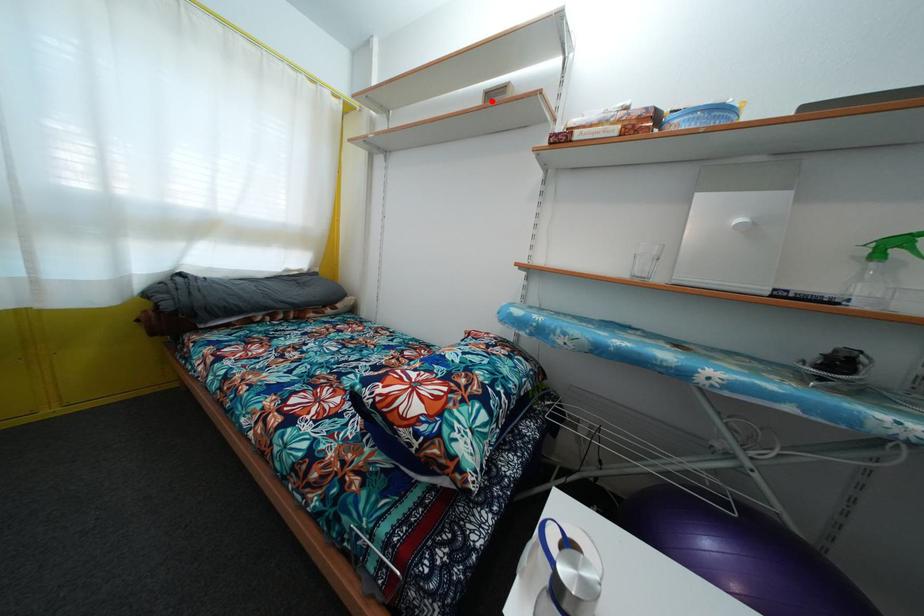
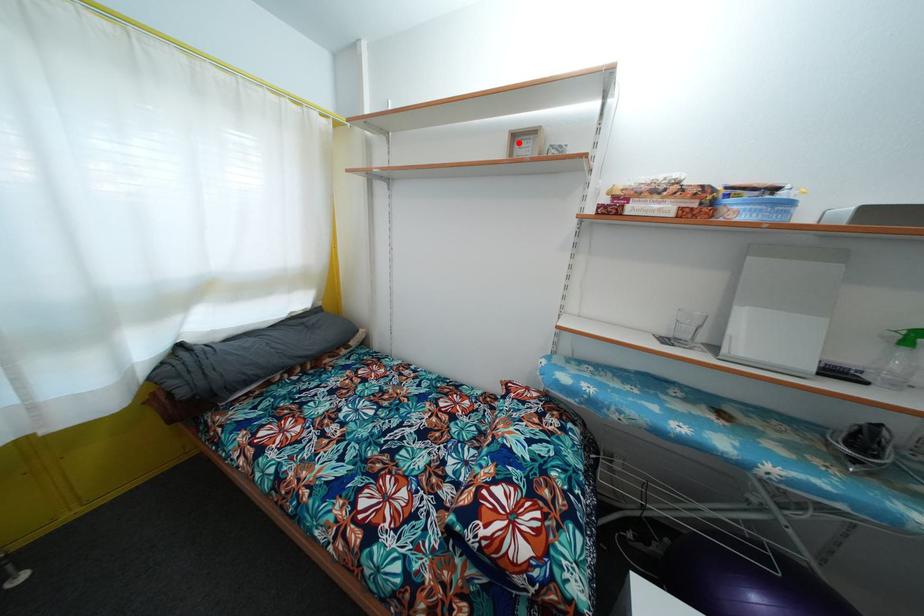
I am providing you with two images of the same scene from different viewpoints. A red point is marked on the first image and another point is marked on the second image. Do the highlighted points in image1 and image2 indicate the same real-world spot?

Yes